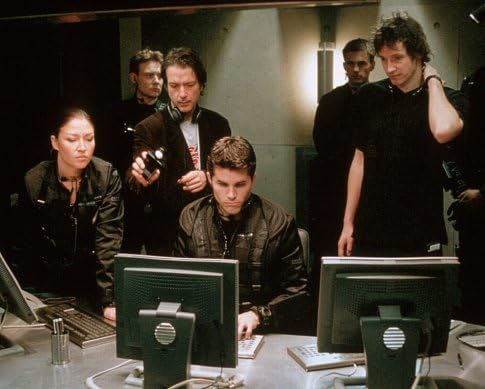
Locate an element on the screen. The height and width of the screenshot is (389, 485). wall lamp is located at coordinates (328, 72).